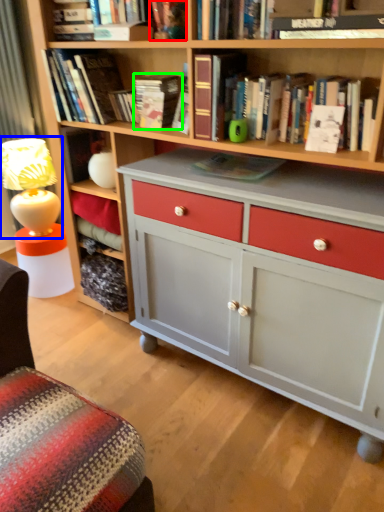
Question: Which object is the closest to the book (highlighted by a red box)? Choose among these: table lamp (highlighted by a blue box) or book (highlighted by a green box).

Choices:
 (A) table lamp
 (B) book

Answer: (B)